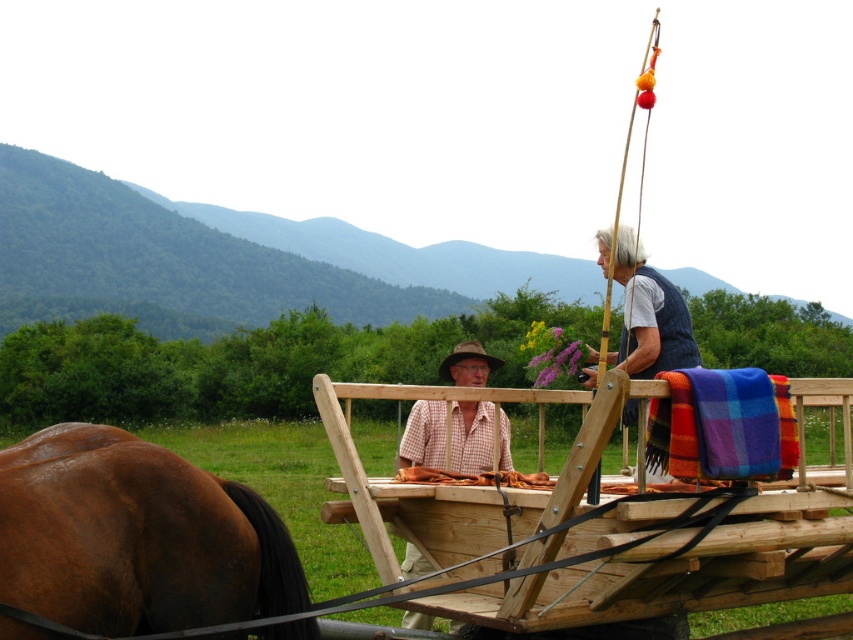
Question: Can you confirm if brown glossy horse at left is positioned to the right of plaid woolen blanket at upper right?

Choices:
 (A) no
 (B) yes

Answer: (A)

Question: Can you confirm if brown glossy horse at left is smaller than plaid woolen blanket at upper right?

Choices:
 (A) yes
 (B) no

Answer: (B)

Question: Among these points, which one is farthest from the camera?

Choices:
 (A) 354,500
 (B) 761,387
 (C) 502,419

Answer: (C)

Question: Among these points, which one is nearest to the camera?

Choices:
 (A) (10, 588)
 (B) (709, 416)
 (C) (370, 552)
 (D) (457, 356)

Answer: (A)

Question: Estimate the real-world distances between objects in this image. Which object is closer to the checkered fabric shirt at center?

Choices:
 (A) wooden cart at center
 (B) plaid woolen blanket at upper right

Answer: (A)

Question: Where is plaid woolen blanket at upper right located in relation to checkered fabric shirt at center in the image?

Choices:
 (A) above
 (B) below

Answer: (B)